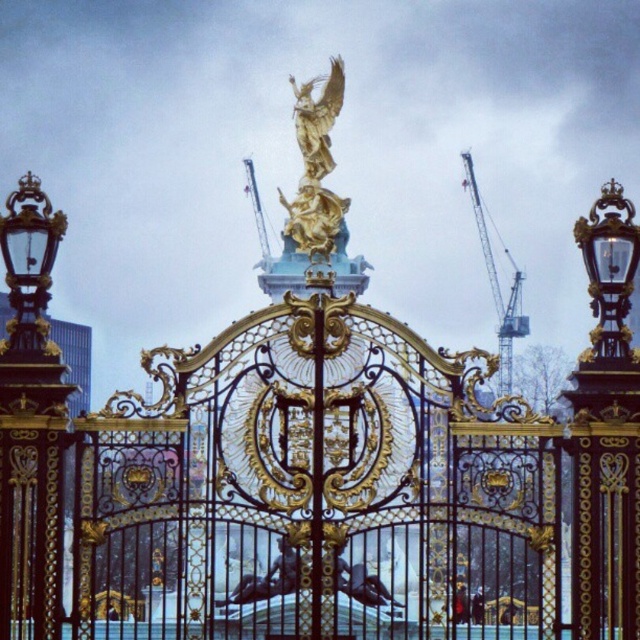
Question: Is gold ornate lamp post at left to the left of gold polished statue at center from the viewer's perspective?

Choices:
 (A) yes
 (B) no

Answer: (A)

Question: Is gold ornate lamp post at left above gold polished statue at center?

Choices:
 (A) yes
 (B) no

Answer: (B)

Question: Which point appears closest to the camera in this image?

Choices:
 (A) (512, 445)
 (B) (609, 246)
 (C) (509, 317)

Answer: (A)

Question: Based on their relative distances, which object is nearer to the gold ornate lamp post at left?

Choices:
 (A) gold ornate gate at center
 (B) polished brass lantern at upper right

Answer: (A)

Question: Can you confirm if polished brass lantern at upper right is positioned above metallic gray crane at upper right?

Choices:
 (A) no
 (B) yes

Answer: (A)

Question: Which object is the farthest from the gold ornate gate at center?

Choices:
 (A) gold polished statue at center
 (B) gold ornate lamp post at left
 (C) polished brass lantern at upper right
 (D) metallic gray crane at upper right

Answer: (D)